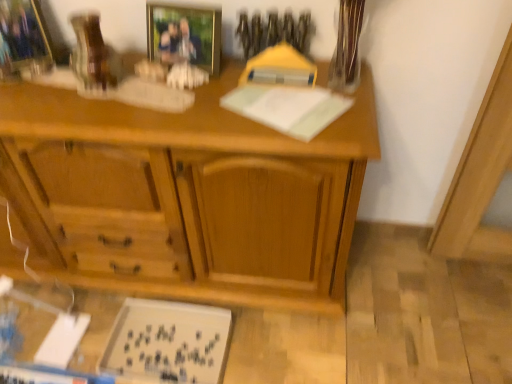
What is the approximate height of gold-framed photo at upper center, which is counted as the first picture frame, starting from the right?

gold-framed photo at upper center, which is counted as the first picture frame, starting from the right, is 7.09 inches in height.

I want to click on wooden desk at center, so click(x=188, y=196).

Where is `gold-framed photo at upper center, which is counted as the first picture frame, starting from the right`? This screenshot has height=384, width=512. gold-framed photo at upper center, which is counted as the first picture frame, starting from the right is located at coordinates (184, 35).

Can we say white matte board at lower left lies outside gold-framed photo at upper center, which is counted as the first picture frame, starting from the right?

Indeed, white matte board at lower left is completely outside gold-framed photo at upper center, which is counted as the first picture frame, starting from the right.

Identify the location of the 2nd picture frame in front of the white matte board at lower left. (184, 35).

Looking at the image, does white matte board at lower left seem bigger or smaller compared to gold-framed photo at upper center, which is the 2th picture frame from left to right?

Clearly, white matte board at lower left is larger in size than gold-framed photo at upper center, which is the 2th picture frame from left to right.

Does point (215, 359) come in front of point (190, 33)?

No, it is behind (190, 33).

Does gold-framed photo at upper center, which is counted as the first picture frame, starting from the right, turn towards wooden desk at center?

No, gold-framed photo at upper center, which is counted as the first picture frame, starting from the right, does not turn towards wooden desk at center.

Which object is more forward, gold-framed photo at upper center, which is counted as the first picture frame, starting from the right, or wooden desk at center?

wooden desk at center is more forward.

Which of these two, gold-framed photo at upper center, which is the 2th picture frame from left to right, or wooden desk at center, is wider?

With larger width is wooden desk at center.

Measure the distance between wooden desk at center and gold-framed photo at upper center, which is the 2th picture frame from left to right.

They are 17.50 inches apart.

Considering the positions of objects wooden desk at center and gold-framed photo at upper center, which is the 2th picture frame from left to right, in the image provided, who is in front, wooden desk at center or gold-framed photo at upper center, which is the 2th picture frame from left to right,?

wooden desk at center.

From a real-world perspective, which is physically below, wooden desk at center or gold-framed photo at upper center, which is the 2th picture frame from left to right?

wooden desk at center is physically lower.

Is wooden desk at center inside the boundaries of gold-framed photo at upper center, which is the 2th picture frame from left to right, or outside?

wooden desk at center is not enclosed by gold-framed photo at upper center, which is the 2th picture frame from left to right.

Considering the relative sizes of gold-framed photo at upper center, which is the 2th picture frame from left to right, and clear glass vase at upper right in the image provided, is gold-framed photo at upper center, which is the 2th picture frame from left to right, wider than clear glass vase at upper right?

Incorrect, the width of gold-framed photo at upper center, which is the 2th picture frame from left to right, does not surpass that of clear glass vase at upper right.

From the image's perspective, between gold-framed photo at upper center, which is the 2th picture frame from left to right, and clear glass vase at upper right, which one is located above?

gold-framed photo at upper center, which is the 2th picture frame from left to right.

In terms of size, does gold-framed photo at upper center, which is the 2th picture frame from left to right, appear bigger or smaller than clear glass vase at upper right?

Clearly, gold-framed photo at upper center, which is the 2th picture frame from left to right, is smaller in size than clear glass vase at upper right.

Considering the sizes of gold-framed photo at upper center, which is the 2th picture frame from left to right, and clear glass vase at upper right in the image, is gold-framed photo at upper center, which is the 2th picture frame from left to right, taller or shorter than clear glass vase at upper right?

In the image, gold-framed photo at upper center, which is the 2th picture frame from left to right, appears to be shorter than clear glass vase at upper right.

Is wooden desk at center aimed at clear glass vase at upper right?

No, wooden desk at center is not facing towards clear glass vase at upper right.

Between wooden desk at center and clear glass vase at upper right, which one has smaller size?

With smaller size is clear glass vase at upper right.

From the image's perspective, is wooden desk at center located above clear glass vase at upper right?

No, from the image's perspective, wooden desk at center is not above clear glass vase at upper right.

Is clear glass vase at upper right to the left of wooden desk at center from the viewer's perspective?

Incorrect, clear glass vase at upper right is not on the left side of wooden desk at center.

Is clear glass vase at upper right surrounding wooden desk at center?

Definitely not — wooden desk at center is not inside clear glass vase at upper right.

Which object is thinner, clear glass vase at upper right or wooden desk at center?

Thinner between the two is clear glass vase at upper right.

Which object is closer to the camera taking this photo, clear glass vase at upper right or brushed metal picture frame at upper left, which ranks as the 2th picture frame in right-to-left order?

Positioned in front is clear glass vase at upper right.

Is clear glass vase at upper right placed right next to brushed metal picture frame at upper left, which ranks as the 2th picture frame in right-to-left order?

No, clear glass vase at upper right is not making contact with brushed metal picture frame at upper left, which ranks as the 2th picture frame in right-to-left order.

Where is `picture frame on the right of white matte board at lower left`? picture frame on the right of white matte board at lower left is located at coordinates (184, 35).

I want to click on the 1st picture frame behind the wooden desk at center, so click(184, 35).

Looking at the image, which one is located further to wooden desk at center, gold-framed photo at upper center, which is counted as the first picture frame, starting from the right, or brushed metal picture frame at upper left, which ranks as the 2th picture frame in right-to-left order?

Among the two, brushed metal picture frame at upper left, which ranks as the 2th picture frame in right-to-left order, is located further to wooden desk at center.

Looking at the image, which one is located closer to gold-framed photo at upper center, which is counted as the first picture frame, starting from the right, wooden desk at center or brushed metal picture frame at upper left, which ranks as the 2th picture frame in right-to-left order?

brushed metal picture frame at upper left, which ranks as the 2th picture frame in right-to-left order, lies closer to gold-framed photo at upper center, which is counted as the first picture frame, starting from the right, than the other object.

In the scene shown: From the image, which object appears to be farther from brushed metal picture frame at upper left, placed as the first picture frame when sorted from left to right, white matte board at lower left or wooden desk at center?

white matte board at lower left is positioned further to the anchor brushed metal picture frame at upper left, placed as the first picture frame when sorted from left to right.

Based on their spatial positions, is brushed metal picture frame at upper left, placed as the first picture frame when sorted from left to right, or white matte board at lower left closer to gold-framed photo at upper center, which is counted as the first picture frame, starting from the right?

The object closer to gold-framed photo at upper center, which is counted as the first picture frame, starting from the right, is brushed metal picture frame at upper left, placed as the first picture frame when sorted from left to right.

From the picture: Based on their spatial positions, is wooden desk at center or white matte board at lower left further from brushed metal picture frame at upper left, which ranks as the 2th picture frame in right-to-left order?

white matte board at lower left.

Based on their spatial positions, is gold-framed photo at upper center, which is counted as the first picture frame, starting from the right, or wooden desk at center further from white matte board at lower left?

Based on the image, gold-framed photo at upper center, which is counted as the first picture frame, starting from the right, appears to be further to white matte board at lower left.

From the image, which object appears to be nearer to clear glass vase at upper right, wooden desk at center or gold-framed photo at upper center, which is counted as the first picture frame, starting from the right?

gold-framed photo at upper center, which is counted as the first picture frame, starting from the right.

Looking at the image, which one is located further to clear glass vase at upper right, wooden desk at center or white matte board at lower left?

Among the two, white matte board at lower left is located further to clear glass vase at upper right.

This screenshot has height=384, width=512. Find the location of `desk that lies between brushed metal picture frame at upper left, placed as the first picture frame when sorted from left to right, and white matte board at lower left from top to bottom`. desk that lies between brushed metal picture frame at upper left, placed as the first picture frame when sorted from left to right, and white matte board at lower left from top to bottom is located at coordinates (188, 196).

Find the location of a particular element. The height and width of the screenshot is (384, 512). glass vase between brushed metal picture frame at upper left, which ranks as the 2th picture frame in right-to-left order, and white matte board at lower left vertically is located at coordinates (347, 47).

This screenshot has width=512, height=384. I want to click on desk that lies between gold-framed photo at upper center, which is counted as the first picture frame, starting from the right, and white matte board at lower left from top to bottom, so (188, 196).

I want to click on desk that lies between clear glass vase at upper right and white matte board at lower left from top to bottom, so click(188, 196).